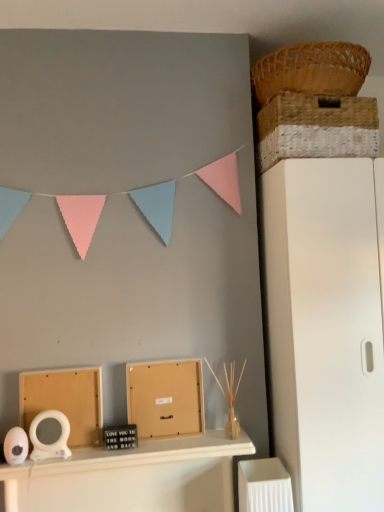
Locate an element on the screen. The image size is (384, 512). empty space that is ontop of woven straw basket at upper right, the 1th basket ordered from the bottom is located at coordinates (312, 88).